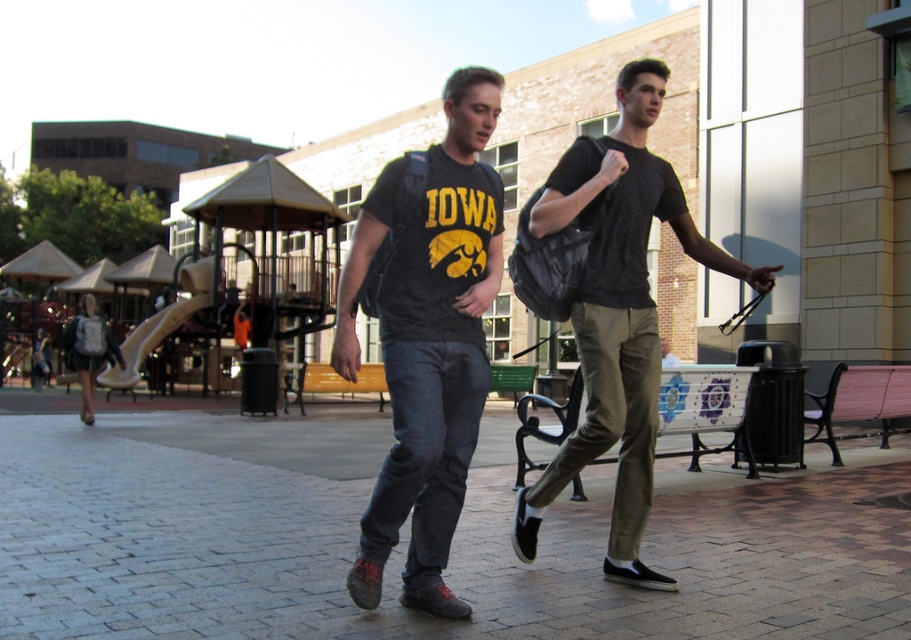
Question: Which point is closer to the camera?

Choices:
 (A) (437, 310)
 (B) (136, 438)

Answer: (A)

Question: Is distressed black t-shirt at center below black mesh bag at center?

Choices:
 (A) no
 (B) yes

Answer: (B)

Question: Which point is farther to the camera?

Choices:
 (A) (725, 580)
 (B) (426, 368)
 (C) (602, 448)

Answer: (A)

Question: Is brick pavement at center bigger than distressed black t-shirt at center?

Choices:
 (A) no
 (B) yes

Answer: (B)

Question: Is brick pavement at center above distressed black t-shirt at center?

Choices:
 (A) yes
 (B) no

Answer: (B)

Question: Which point is farther from the camera taking this photo?

Choices:
 (A) (613, 499)
 (B) (367, 545)

Answer: (A)